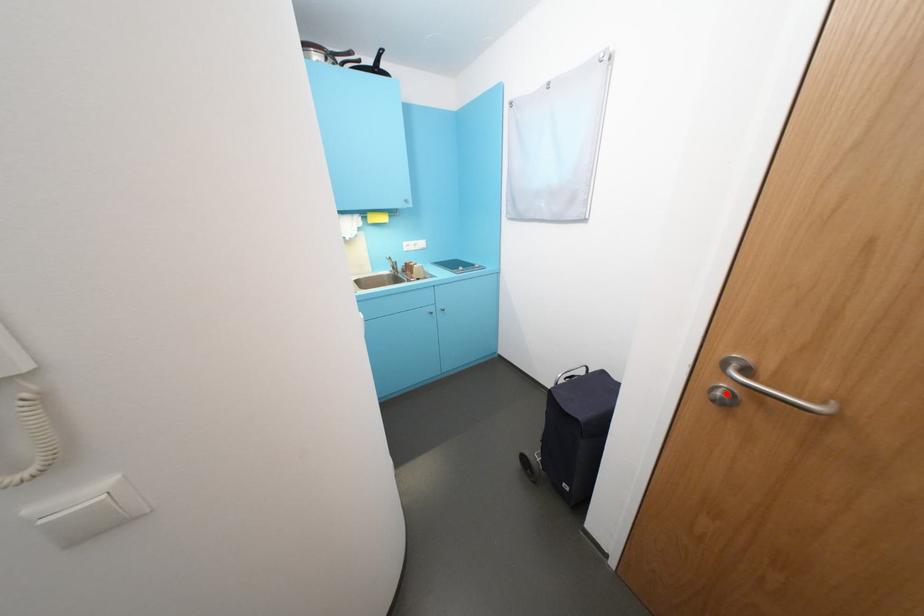
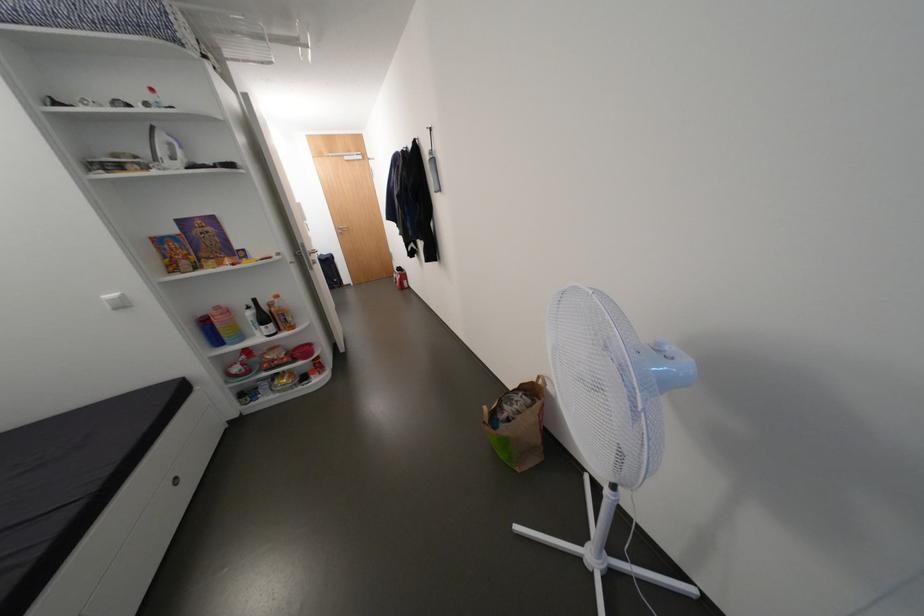
In the second image, find the point that corresponds to the highlighted location in the first image.

(348, 233)